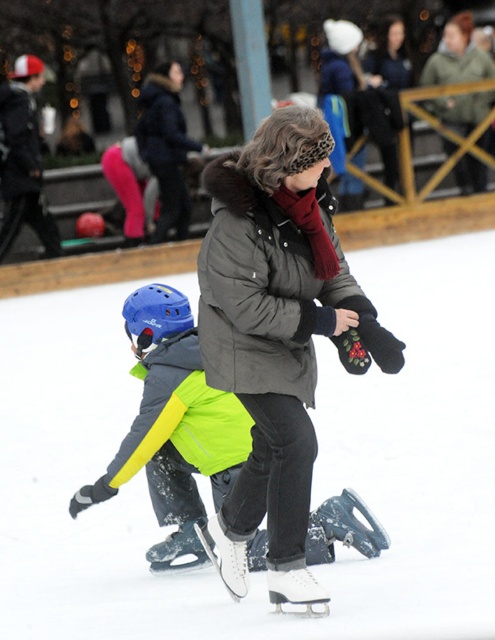
Between matte black jacket at upper left and dark green jacket at upper center, which one is positioned higher?

Positioned higher is dark green jacket at upper center.

Is the position of matte black jacket at upper left less distant than that of dark green jacket at upper center?

Yes, it is.

This screenshot has height=640, width=495. What do you see at coordinates (22, 157) in the screenshot?
I see `matte black jacket at upper left` at bounding box center [22, 157].

Identify the location of matte black jacket at upper left. This screenshot has height=640, width=495. (22, 157).